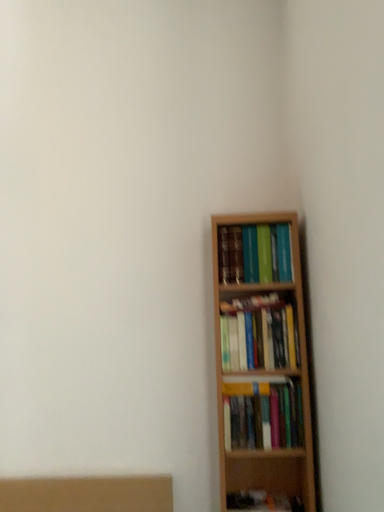
Question: Is wooden bookshelf at right, placed as the 2th book when sorted from bottom to top, at the back of hardcover books at upper right, marked as the 1th book in a top-to-bottom arrangement?

Choices:
 (A) yes
 (B) no

Answer: (B)

Question: From a real-world perspective, is hardcover books at upper right, marked as the 1th book in a top-to-bottom arrangement, located higher than wooden bookshelf at right, the second book viewed from the top?

Choices:
 (A) yes
 (B) no

Answer: (A)

Question: Is hardcover books at upper right, marked as the 1th book in a top-to-bottom arrangement, closer to the viewer compared to wooden bookshelf at right, the second book viewed from the top?

Choices:
 (A) yes
 (B) no

Answer: (B)

Question: Can you confirm if hardcover books at upper right, marked as the 1th book in a top-to-bottom arrangement, is bigger than wooden bookshelf at right, placed as the 2th book when sorted from bottom to top?

Choices:
 (A) no
 (B) yes

Answer: (B)

Question: From the image's perspective, is hardcover books at upper right, the third book ordered from the bottom, on top of wooden bookshelf at right, placed as the 2th book when sorted from bottom to top?

Choices:
 (A) yes
 (B) no

Answer: (A)

Question: From the image's perspective, is wooden bookshelf at right, placed as the 1th book when sorted from bottom to top, located above or below wooden bookshelf at right, placed as the 2th book when sorted from bottom to top?

Choices:
 (A) below
 (B) above

Answer: (A)

Question: Considering the positions of wooden bookshelf at right, marked as the third book in a top-to-bottom arrangement, and wooden bookshelf at right, the second book viewed from the top, in the image, is wooden bookshelf at right, marked as the third book in a top-to-bottom arrangement, wider or thinner than wooden bookshelf at right, the second book viewed from the top,?

Choices:
 (A) thin
 (B) wide

Answer: (B)

Question: Choose the correct answer: Is wooden bookshelf at right, placed as the 1th book when sorted from bottom to top, inside wooden bookshelf at right, the second book viewed from the top, or outside it?

Choices:
 (A) outside
 (B) inside

Answer: (A)

Question: Considering the positions of point (225, 410) and point (226, 365), is point (225, 410) closer or farther from the camera than point (226, 365)?

Choices:
 (A) farther
 (B) closer

Answer: (B)

Question: Is point (286, 258) closer or farther from the camera than point (263, 409)?

Choices:
 (A) farther
 (B) closer

Answer: (A)

Question: Would you say hardcover books at upper right, marked as the 1th book in a top-to-bottom arrangement, is inside or outside wooden bookshelf at right, placed as the 1th book when sorted from bottom to top?

Choices:
 (A) inside
 (B) outside

Answer: (B)

Question: From a real-world perspective, is hardcover books at upper right, the third book ordered from the bottom, positioned above or below wooden bookshelf at right, marked as the third book in a top-to-bottom arrangement?

Choices:
 (A) below
 (B) above

Answer: (B)

Question: From the image's perspective, is hardcover books at upper right, the third book ordered from the bottom, located above or below wooden bookshelf at right, marked as the third book in a top-to-bottom arrangement?

Choices:
 (A) above
 (B) below

Answer: (A)

Question: From the image's perspective, is hardcover books at upper right, the third book ordered from the bottom, located above or below wooden bookshelf at right, placed as the 2th book when sorted from bottom to top?

Choices:
 (A) below
 (B) above

Answer: (B)

Question: Considering their positions, is hardcover books at upper right, marked as the 1th book in a top-to-bottom arrangement, located in front of or behind wooden bookshelf at right, the second book viewed from the top?

Choices:
 (A) behind
 (B) front

Answer: (A)